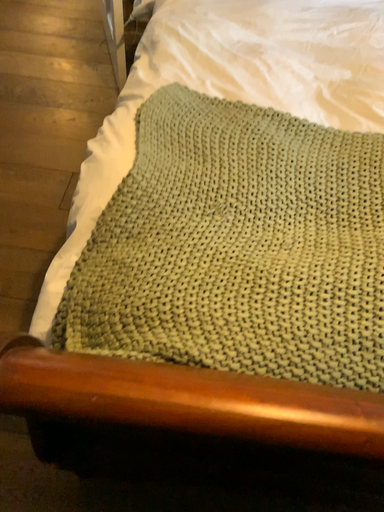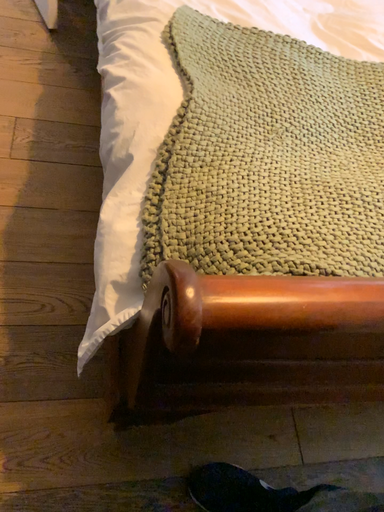
Question: Which way did the camera rotate in the video?

Choices:
 (A) rotated right
 (B) rotated left

Answer: (A)